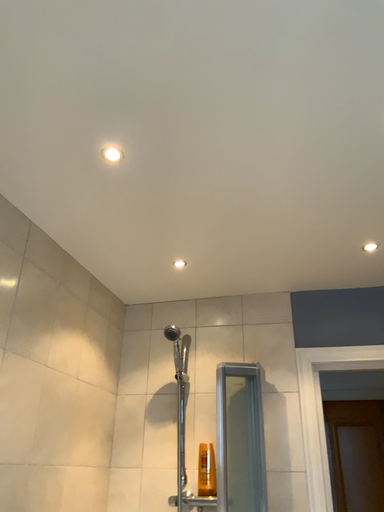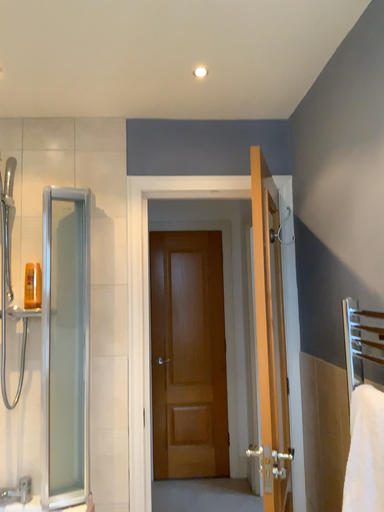
Question: Which way did the camera rotate in the video?

Choices:
 (A) rotated upward
 (B) rotated downward

Answer: (B)